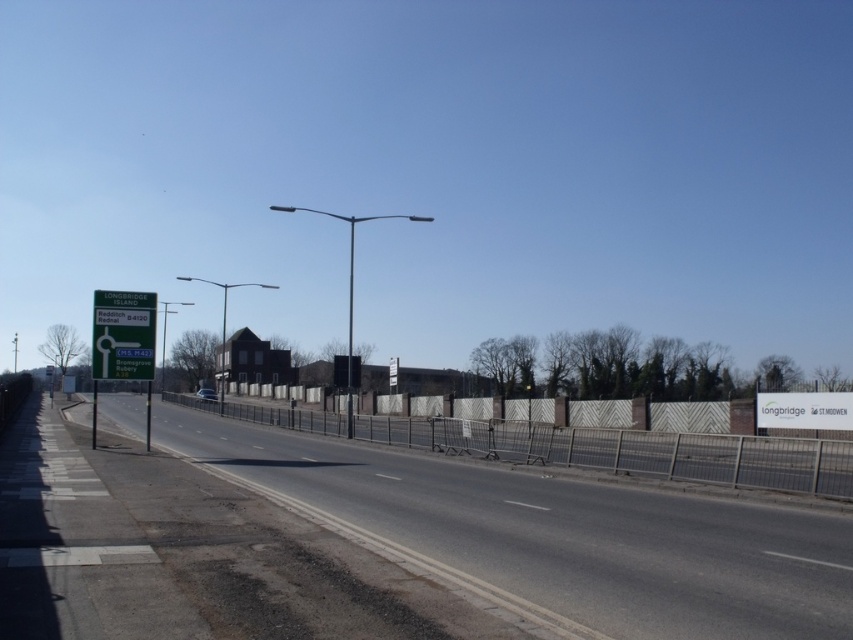
You are a delivery driver who needs to navigate through the road shown in the image. You see two points marked on your GPS navigation system at coordinates point (479, 452) and point (103, 292). According to the scene description, which point is further along the road from your current position?

Point (479, 452) is behind point (103, 292), so it is further along the road from your current position.

You are a delivery driver planning to park your truck on the asphalt road at left. The truck has a height of 2 meters. The white wood fence at center is part of a loading zone that requires vehicles to be lower than the fence. Can your truck safely park there?

The asphalt road at left has a lesser height compared to white wood fence at center. Since the truck is 2 meters tall and the fence is taller, the truck can safely park there as its height is below the fence requirement.

You are standing at the side of the road and want to cross to the other side. The asphalt road at left is 6.17 meters away from you. If your walking speed is 1.5 meters per second, how many seconds will it take you to cross the road safely?

To cross the asphalt road at left which is 6.17 meters wide at a speed of 1.5 meters per second, it would take approximately 4.11 seconds. Since the road is 6.17 meters wide, dividing the distance by the speed gives 6.17 divided by 1.5, which equals roughly 4.11 seconds.